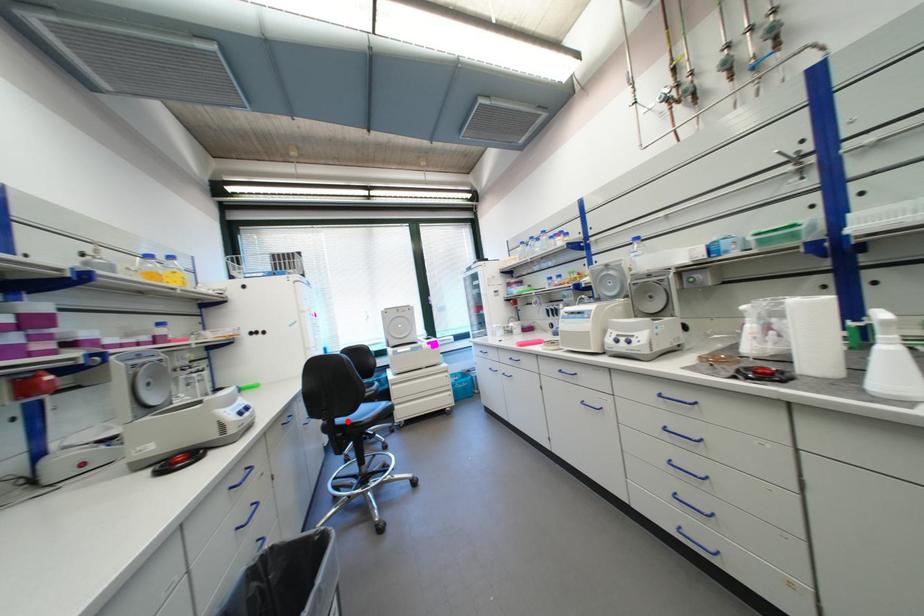
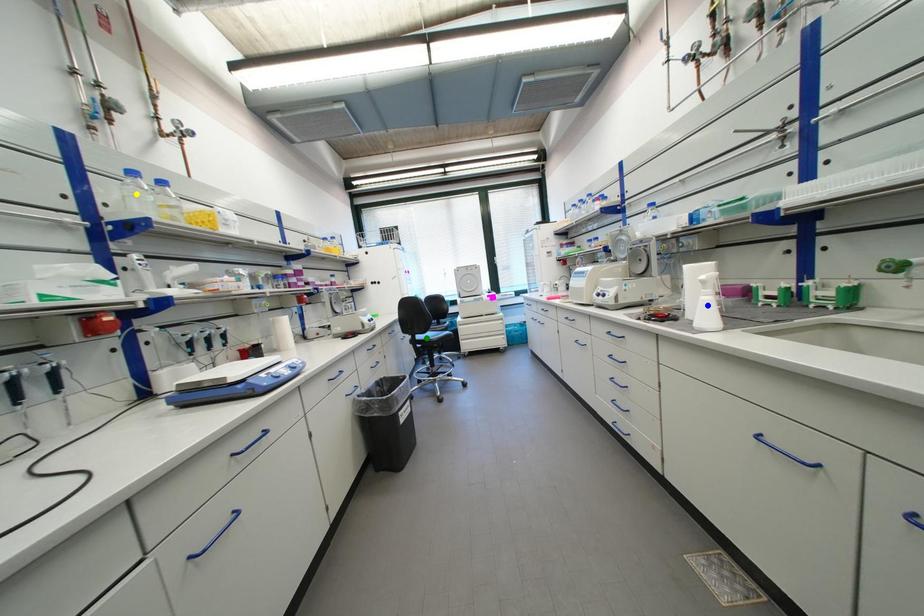
Question: I am providing you with two images of the same scene from different viewpoints. A red point is marked on the first image. You are given multiple points on the second image. Can you choose the point in image 2 that corresponds to the point in image 1?

Choices:
 (A) blue point
 (B) green point
 (C) yellow point

Answer: (B)